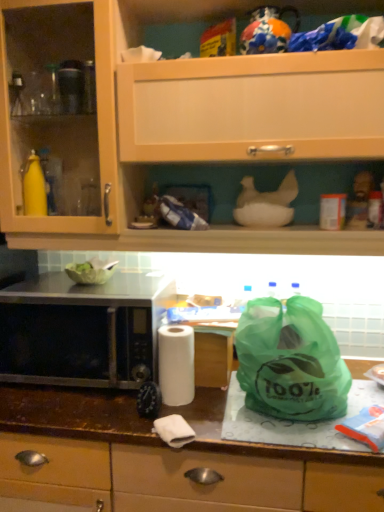
Where is `free space that is to the left of white matte paper towel at center`? Image resolution: width=384 pixels, height=512 pixels. free space that is to the left of white matte paper towel at center is located at coordinates (106, 414).